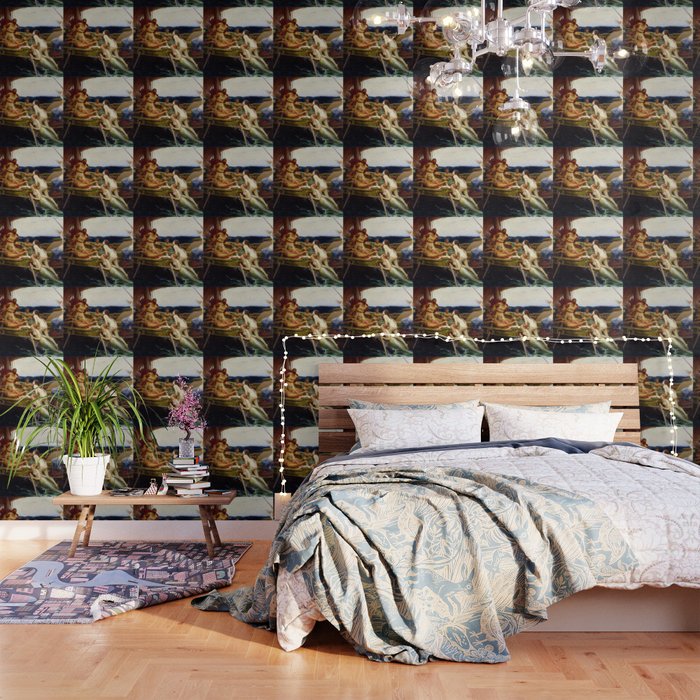
Identify the location of floor. (190, 657).